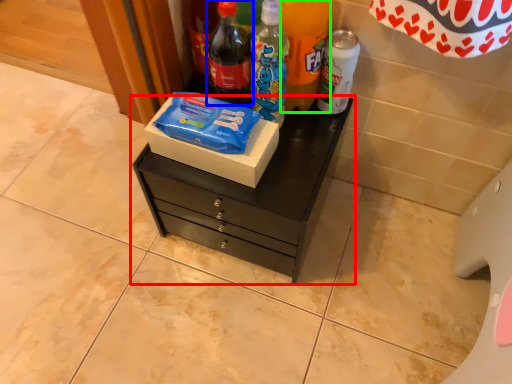
Question: Based on their relative distances, which object is farther from chest of drawers (highlighted by a red box)? Choose from bottle (highlighted by a blue box) and bottle (highlighted by a green box).

Choices:
 (A) bottle
 (B) bottle

Answer: (B)